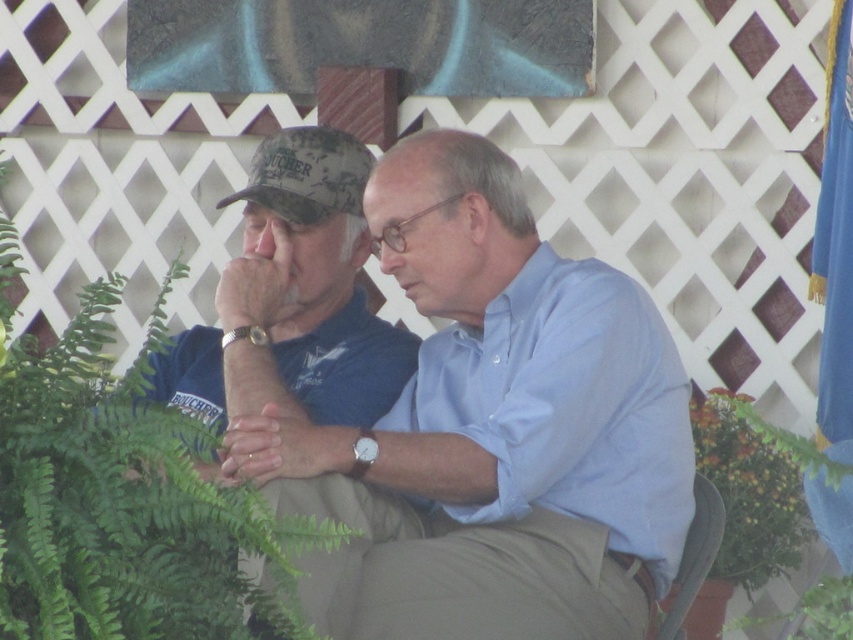
Is point (221, 621) closer to camera compared to point (296, 170)?

That is True.

Is green leafy plant at left above camouflage fabric baseball cap at left?

No.

Find the location of a particular element. The width and height of the screenshot is (853, 640). green leafy plant at left is located at coordinates (109, 497).

Which is more to the left, light blue shirt at center or light blue cotton shirt at center?

light blue shirt at center is more to the left.

Is light blue shirt at center bigger than light blue cotton shirt at center?

Yes.

Which is behind, point (434, 204) or point (494, 440)?

Point (434, 204)

This screenshot has height=640, width=853. In order to click on light blue shirt at center in this screenshot , I will do `click(492, 429)`.

Is light blue shirt at center shorter than green leafy plant at left?

In fact, light blue shirt at center may be taller than green leafy plant at left.

Is point (412, 632) closer to viewer compared to point (144, 417)?

No.

Is point (433, 268) farther from viewer compared to point (103, 595)?

Yes.

Locate an element on the screen. The width and height of the screenshot is (853, 640). light blue shirt at center is located at coordinates (492, 429).